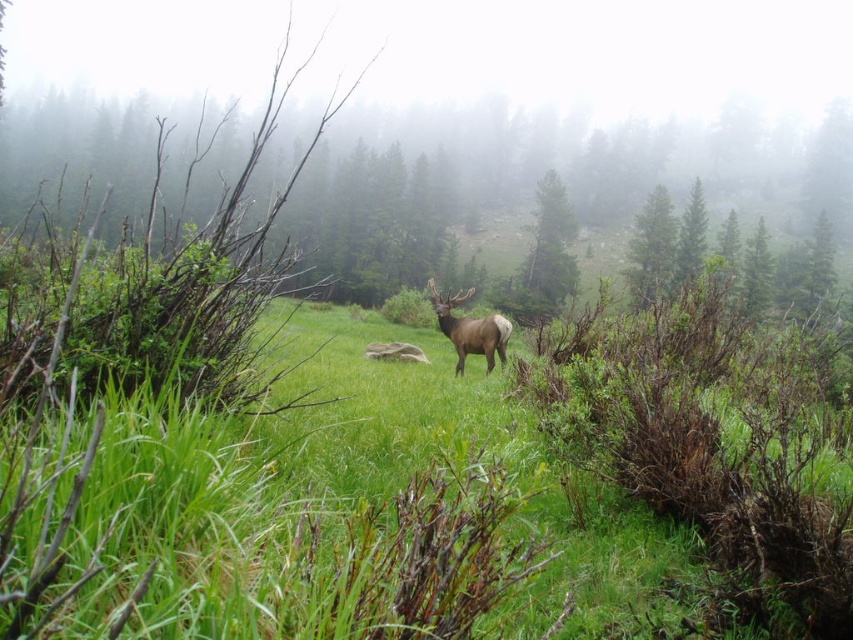
Question: Is the position of green grassy at center more distant than that of brown velvet deer at center?

Choices:
 (A) yes
 (B) no

Answer: (B)

Question: Which of the following is the farthest from the observer?

Choices:
 (A) green leafy tree at upper center
 (B) green textured pine tree at center

Answer: (B)

Question: Can you confirm if green grassy at center is positioned below green leafy tree at upper center?

Choices:
 (A) no
 (B) yes

Answer: (B)

Question: Which of the following is the closest to the observer?

Choices:
 (A) green leafy tree at upper center
 (B) brown velvet deer at center
 (C) green textured pine tree at center
 (D) green grassy at center

Answer: (D)

Question: Does green grassy at center come in front of brown velvet deer at center?

Choices:
 (A) yes
 (B) no

Answer: (A)

Question: Which of the following is the farthest from the observer?

Choices:
 (A) green textured pine tree at center
 (B) green grassy at center
 (C) green leafy tree at upper center
 (D) brown velvet deer at center

Answer: (A)